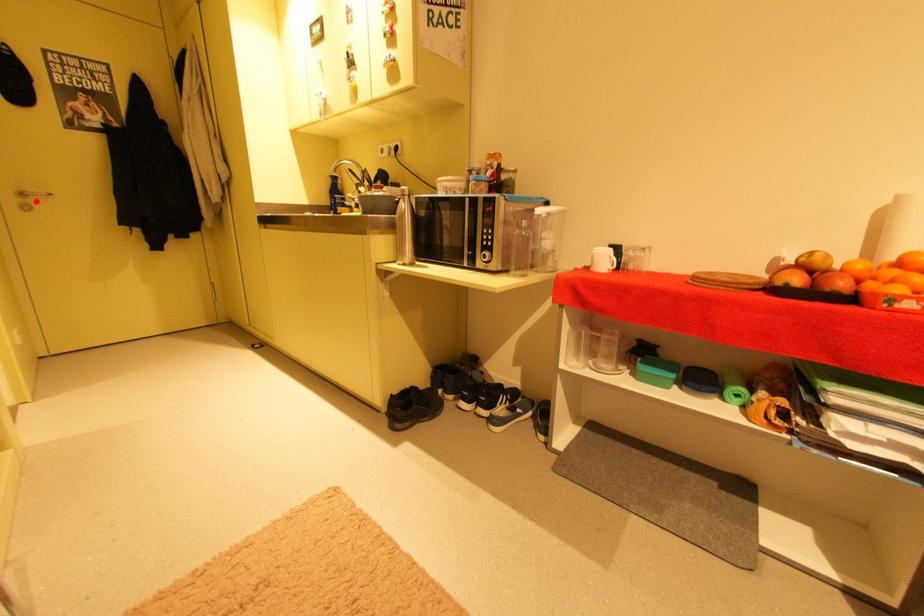
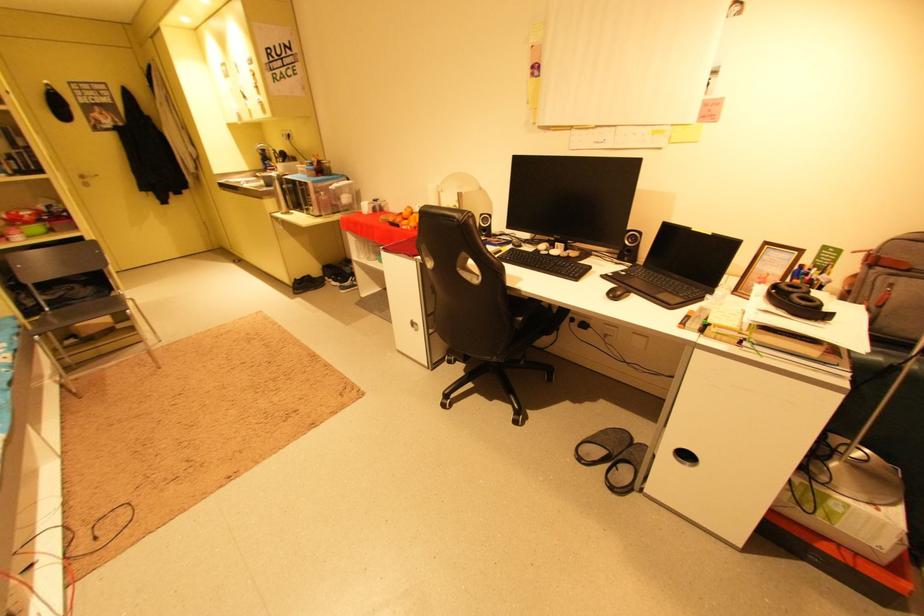
Question: I am providing you with two images of the same scene from different viewpoints. In image1, a red point is highlighted. Considering the same 3D point in image2, which of the following is correct?

Choices:
 (A) It is closer
 (B) It is farther

Answer: (B)